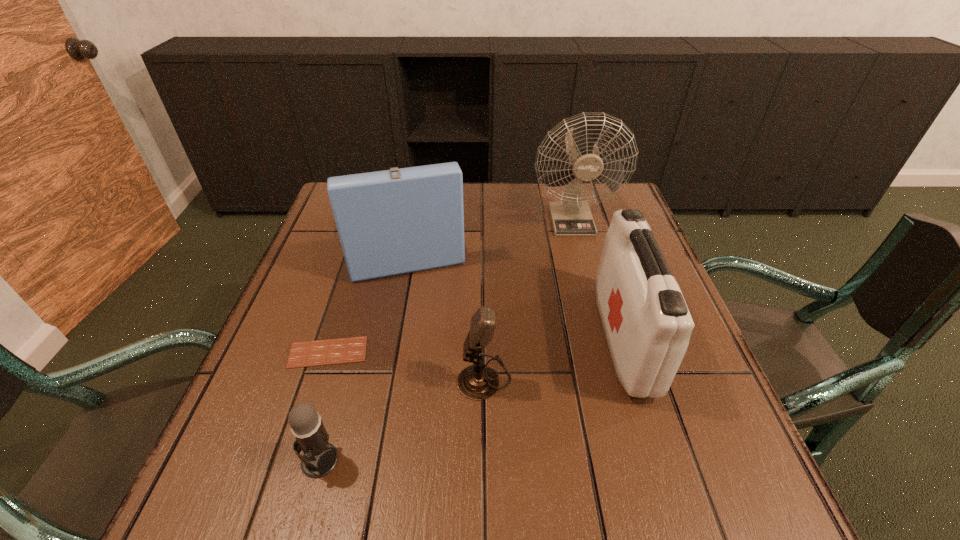
At what (x,y) coordinates should I click in order to perform the action: click on object at the near edge. Please return your answer as a coordinate pair (x, y). Looking at the image, I should click on (320, 457).

Find the location of a particular element. The height and width of the screenshot is (540, 960). phonograph record located in the left edge section of the desktop is located at coordinates (397, 221).

Locate an element on the screen. The width and height of the screenshot is (960, 540). microphone located in the left edge section of the desktop is located at coordinates (320, 457).

This screenshot has height=540, width=960. I want to click on chocolate bar that is positioned at the left edge, so click(x=353, y=349).

This screenshot has width=960, height=540. I want to click on fan located in the right edge section of the desktop, so click(572, 217).

Where is `the first-aid kit that is at the right edge`? This screenshot has height=540, width=960. the first-aid kit that is at the right edge is located at coordinates (647, 324).

Find the location of a particular element. object located at the far left corner is located at coordinates (397, 221).

Identify the location of object at the near left corner. The image size is (960, 540). (320, 457).

Find the location of a particular element. This screenshot has height=540, width=960. object present at the far right corner is located at coordinates (572, 217).

Find the location of a particular element. The width and height of the screenshot is (960, 540). free location at the far edge of the desktop is located at coordinates (510, 217).